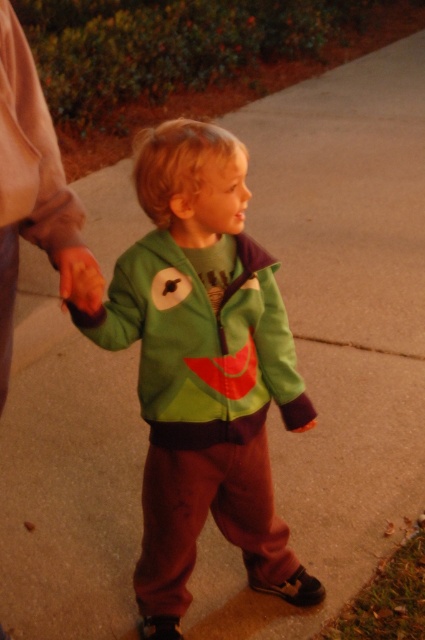
Does point (181, 268) come behind point (269, 339)?

No.

Can you confirm if green matte jacket at center is positioned below green soft jacket at center?

Yes.

Between point (146, 374) and point (268, 291), which one is positioned behind?

Point (268, 291)

Find the location of a particular element. This screenshot has height=640, width=425. green matte jacket at center is located at coordinates (204, 371).

Does green matte jacket at center have a smaller size compared to smooth orange hand at lower left?

No, green matte jacket at center is not smaller than smooth orange hand at lower left.

Does point (232, 298) come farther from viewer compared to point (90, 292)?

Yes, point (232, 298) is farther from viewer.

Locate an element on the screen. Image resolution: width=425 pixels, height=640 pixels. green matte jacket at center is located at coordinates (204, 371).

Between green soft jacket at center and smooth orange hand at lower left, which one has less height?

smooth orange hand at lower left

Can you confirm if green soft jacket at center is smaller than smooth orange hand at lower left?

No, green soft jacket at center is not smaller than smooth orange hand at lower left.

Identify the location of green soft jacket at center. (201, 342).

Locate an element on the screen. green soft jacket at center is located at coordinates point(201,342).